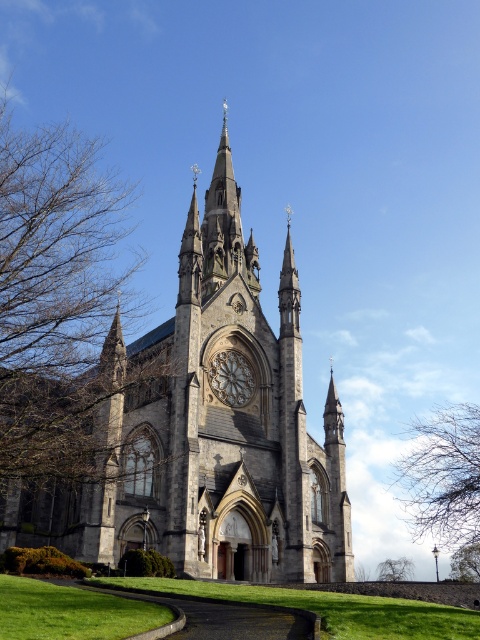
You are standing in front of the Gothic church and notice two points marked on the facade. The first point is at coordinates point (64, 209) and the second is at point (394, 573). Which of these points is nearer to your current position?

Point (64, 209) is closer to the camera than point (394, 573), so the first point is nearer to your current position.

You are standing in front of the Gothic church and notice two trees in the scene. The first is brown leafless branches at left, and the second is green leafy tree at lower right. Which tree appears higher in the image from your viewpoint?

The brown leafless branches at left appears higher in the image than the green leafy tree at lower right because it is located above it according to the description.

You are standing in front of the Gothic church and notice two trees in the scene. One is the bare branches at upper center and the other is the green leafy tree at lower center. Which tree appears taller in the image?

The bare branches at upper center appears taller than the green leafy tree at lower center.